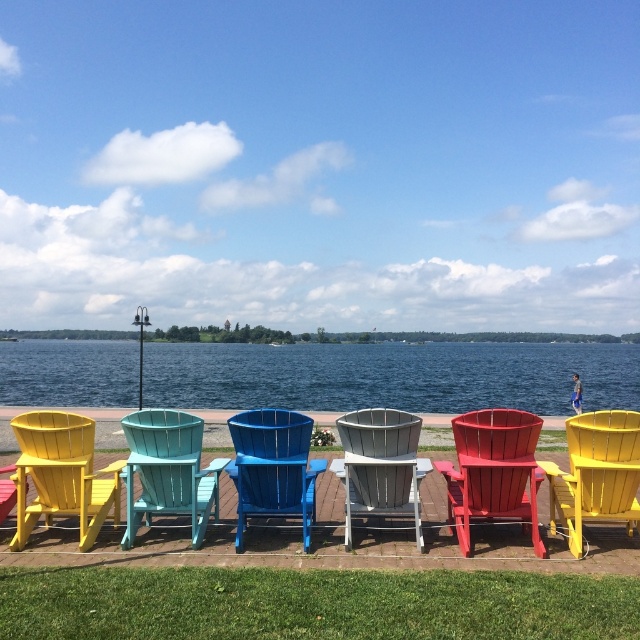
Question: Which of the following is the closest to the observer?

Choices:
 (A) yellow wood beach chair at right
 (B) blue matte beach chair at center

Answer: (A)

Question: Which point is closer to the camera?

Choices:
 (A) teal wood beach chair at center
 (B) matte yellow beach chair at left
 (C) yellow wood beach chair at right
 (D) blue matte beach chair at center

Answer: (C)

Question: Where is yellow wood beach chair at right located in relation to blue matte beach chair at center in the image?

Choices:
 (A) below
 (B) above

Answer: (B)

Question: Which object is the farthest from the matte yellow beach chair at left?

Choices:
 (A) blue matte beach chair at center
 (B) white wood beach chair at center
 (C) yellow wood beach chair at right

Answer: (C)

Question: Considering the relative positions of matte red wooden beach chair at center and teal wood beach chair at center in the image provided, where is matte red wooden beach chair at center located with respect to teal wood beach chair at center?

Choices:
 (A) above
 (B) below

Answer: (B)

Question: Is matte red wooden beach chair at center closer to camera compared to white wood beach chair at center?

Choices:
 (A) yes
 (B) no

Answer: (A)